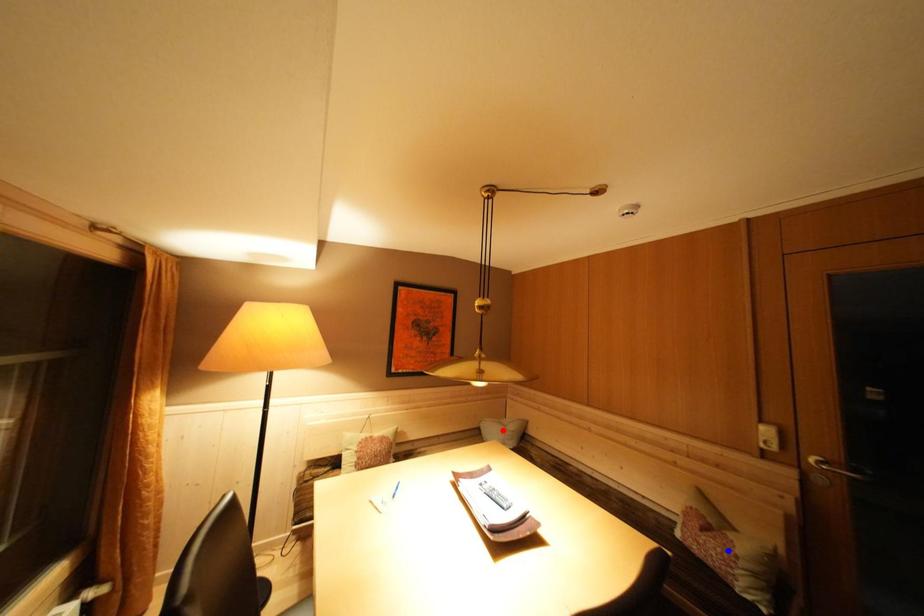
Question: Which of the two points in the image is closer to the camera?

Choices:
 (A) Blue point is closer.
 (B) Red point is closer.

Answer: (A)